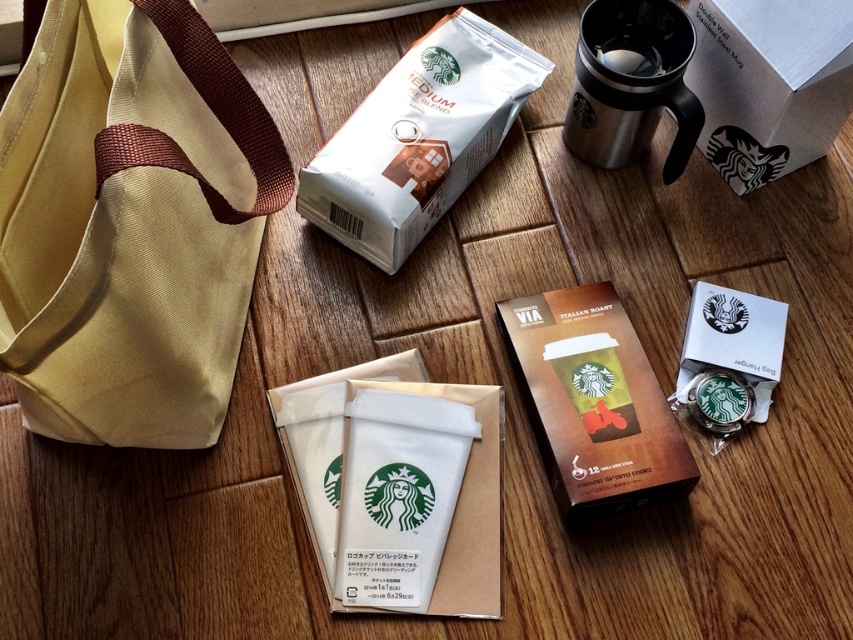
You are a delivery person who needs to place both the beige canvas tote at left and the stainless steel mug at upper right into a box that measures 30 inches in length. Can you fit both items side by side without overlapping?

The beige canvas tote at left and the stainless steel mug at upper right are 25.04 inches apart from each other. Since the box is 30 inches long, which is longer than the combined distance between them, you can fit both items side by side without overlapping.

You are organizing a picnic and need to know which item is closer to you. You see the beige canvas tote at left and the stainless steel mug at upper right. Which one is nearer to your current position?

The beige canvas tote at left is nearer because it is positioned in front of the stainless steel mug at upper right, indicating it is closer to your viewpoint.